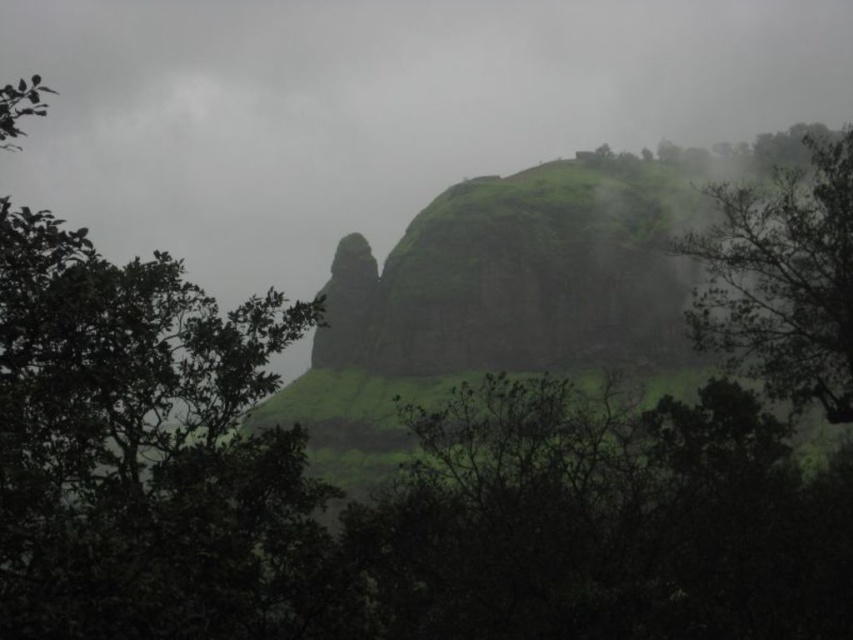
Can you confirm if green leafy tree at center is positioned above green leafy tree at upper right?

Incorrect, green leafy tree at center is not positioned above green leafy tree at upper right.

Describe the element at coordinates (144, 452) in the screenshot. I see `green leafy tree at center` at that location.

Where is `green leafy tree at center`? This screenshot has width=853, height=640. green leafy tree at center is located at coordinates (144, 452).